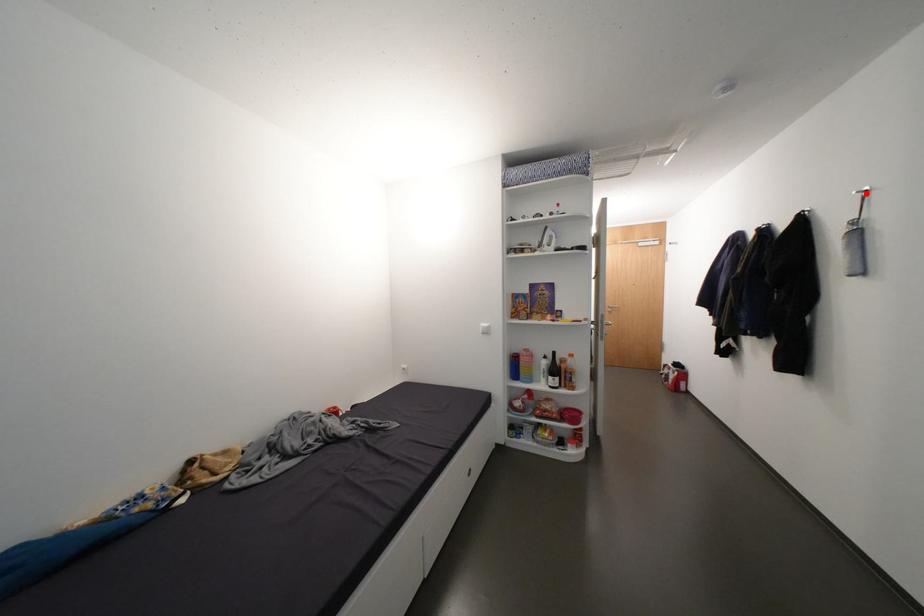
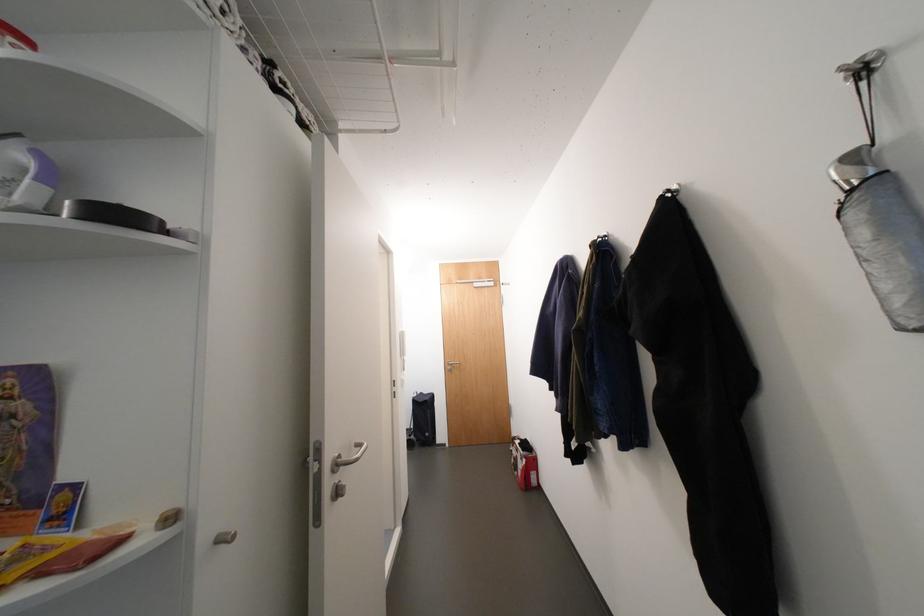
Where in the second image is the point corresponding to the highlighted location from the first image?

(855, 71)